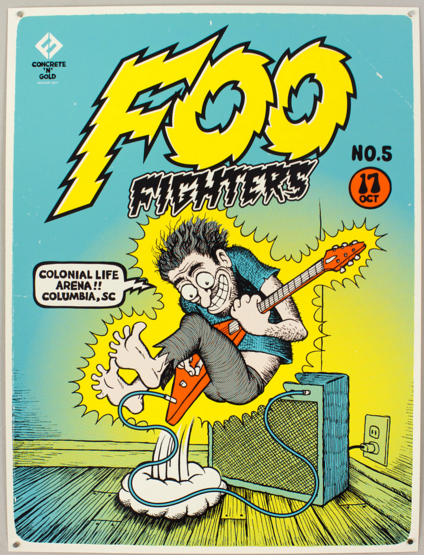
Where is `plug`? The height and width of the screenshot is (555, 424). plug is located at coordinates (359, 447).